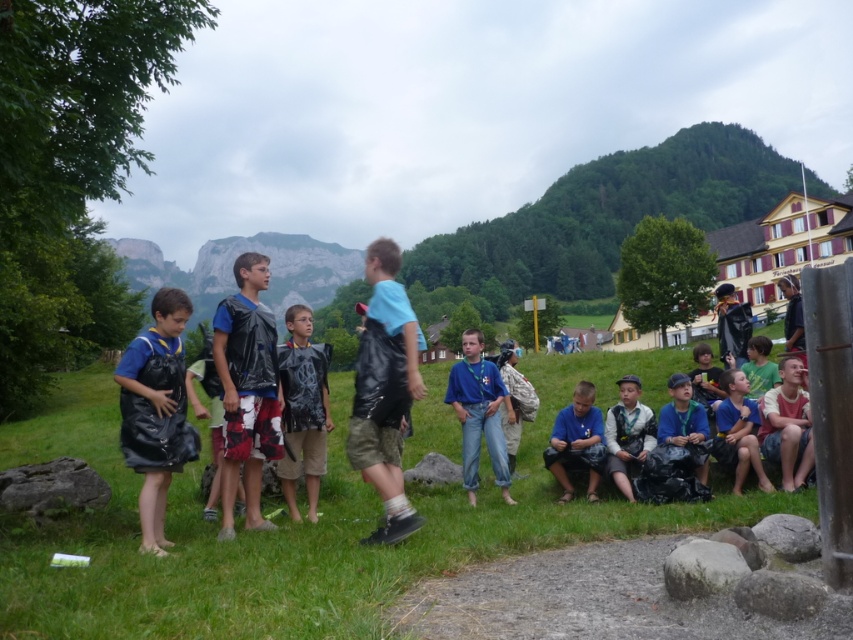
You are a photographer trying to capture a candid shot of the blue denim jeans at center without the matte black backpack at center blocking the view. Can you adjust your position to do so?

The matte black backpack at center is larger in size than the blue denim jeans at center, so moving your position might help, but since the backpack is larger, it might still block the view depending on the angle.

You are a photographer trying to capture a group shot of the children. You notice two children wearing the black matte vest at center and the white cotton shirt at center. Since you want to ensure both are visible, which child should you position closer to the camera to avoid one being hidden behind the other?

The black matte vest at center has a smaller width than the white cotton shirt at center. To prevent the smaller one from being hidden, position the child wearing the black matte vest at center closer to the camera.

You are a photographer standing in the middle of the group of children and want to capture a photo that includes both the rugged stone mountain at upper center and the white cotton shirt at center. Since you want the mountain to be the main focus, which object should you position closer to the front of the photo?

To make the rugged stone mountain at upper center the main focus, you should position the white cotton shirt at center closer to the front of the photo. This way, the mountain, which is further away, will appear larger and more prominent in the background.